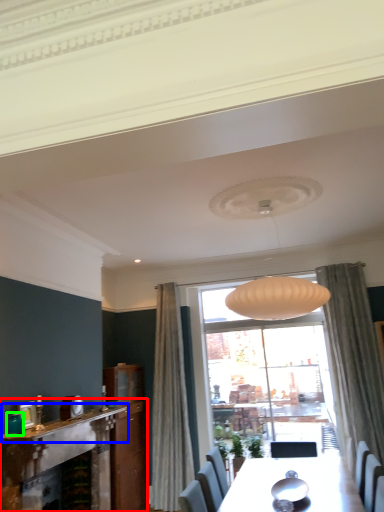
Question: Estimate the real-world distances between objects in this image. Which object is closer to fireplace (highlighted by a red box), mantle (highlighted by a blue box) or teal (highlighted by a green box)?

Choices:
 (A) mantle
 (B) teal

Answer: (A)